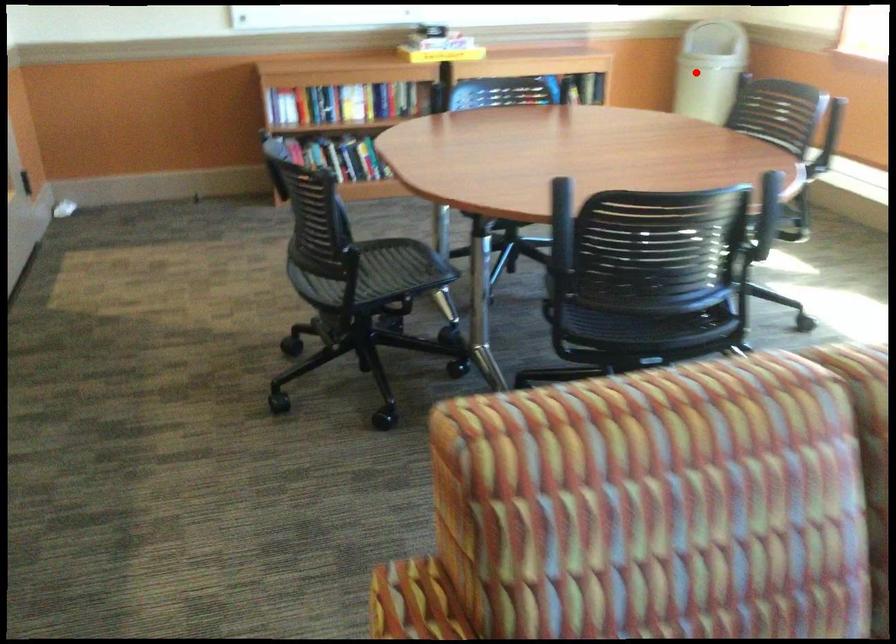
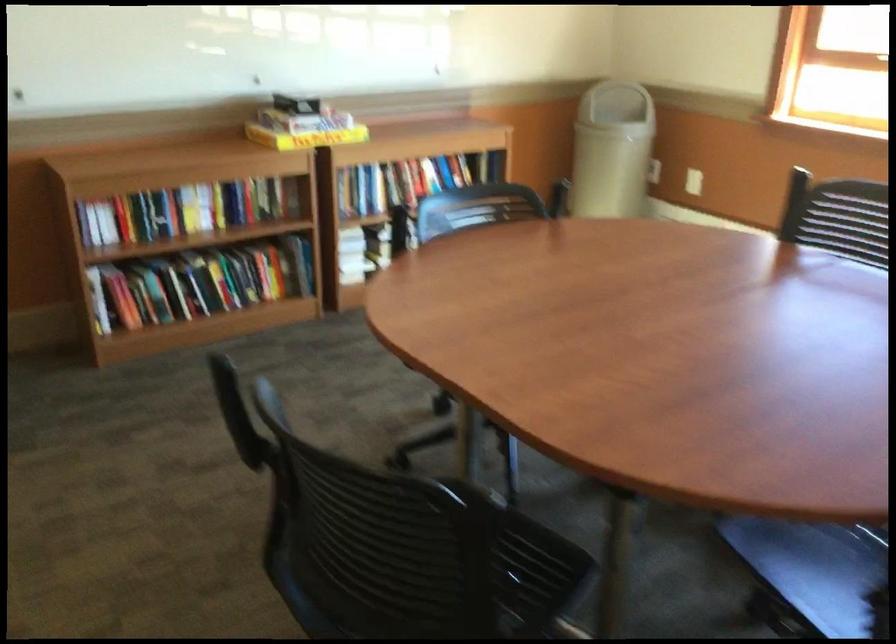
Find the pixel in the second image that matches the highlighted location in the first image.

(612, 149)